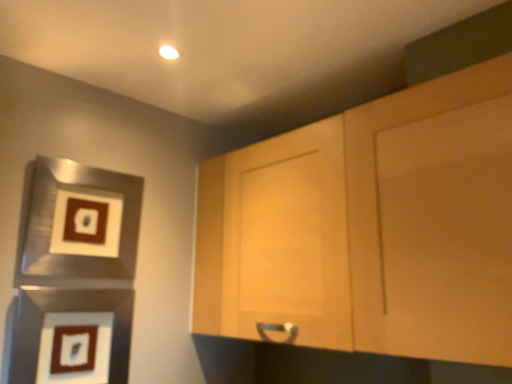
Question: Is matte black picture frame at lower left, positioned as the second picture frame in top-to-bottom order, thinner than light wood cabinet at upper right?

Choices:
 (A) yes
 (B) no

Answer: (A)

Question: Can you confirm if matte black picture frame at lower left, the 1th picture frame when ordered from bottom to top, is taller than light wood cabinet at upper right?

Choices:
 (A) no
 (B) yes

Answer: (A)

Question: Is matte black picture frame at lower left, the 1th picture frame when ordered from bottom to top, not close to light wood cabinet at upper right?

Choices:
 (A) no
 (B) yes

Answer: (A)

Question: From a real-world perspective, is matte black picture frame at lower left, positioned as the second picture frame in top-to-bottom order, below light wood cabinet at upper right?

Choices:
 (A) no
 (B) yes

Answer: (B)

Question: From the image's perspective, is matte black picture frame at lower left, positioned as the second picture frame in top-to-bottom order, above light wood cabinet at upper right?

Choices:
 (A) no
 (B) yes

Answer: (A)

Question: Is matte black picture frame at lower left, the 1th picture frame when ordered from bottom to top, bigger or smaller than brushed metal picture frame at left, the 2th picture frame when ordered from bottom to top?

Choices:
 (A) big
 (B) small

Answer: (B)

Question: Is matte black picture frame at lower left, the 1th picture frame when ordered from bottom to top, inside the boundaries of brushed metal picture frame at left, which appears as the 1th picture frame when viewed from the top, or outside?

Choices:
 (A) outside
 (B) inside

Answer: (A)

Question: In terms of height, does matte black picture frame at lower left, positioned as the second picture frame in top-to-bottom order, look taller or shorter compared to brushed metal picture frame at left, the 2th picture frame when ordered from bottom to top?

Choices:
 (A) short
 (B) tall

Answer: (A)

Question: From the image's perspective, is matte black picture frame at lower left, positioned as the second picture frame in top-to-bottom order, located above or below brushed metal picture frame at left, the 2th picture frame when ordered from bottom to top?

Choices:
 (A) below
 (B) above

Answer: (A)

Question: From a real-world perspective, is brushed metal picture frame at left, the 2th picture frame when ordered from bottom to top, positioned above or below matte black picture frame at lower left, the 1th picture frame when ordered from bottom to top?

Choices:
 (A) below
 (B) above

Answer: (B)

Question: Considering their positions, is brushed metal picture frame at left, which appears as the 1th picture frame when viewed from the top, located in front of or behind matte black picture frame at lower left, positioned as the second picture frame in top-to-bottom order?

Choices:
 (A) front
 (B) behind

Answer: (B)

Question: From the image's perspective, is brushed metal picture frame at left, which appears as the 1th picture frame when viewed from the top, located above or below matte black picture frame at lower left, the 1th picture frame when ordered from bottom to top?

Choices:
 (A) above
 (B) below

Answer: (A)

Question: Is brushed metal picture frame at left, the 2th picture frame when ordered from bottom to top, inside or outside of matte black picture frame at lower left, the 1th picture frame when ordered from bottom to top?

Choices:
 (A) inside
 (B) outside

Answer: (B)

Question: Choose the correct answer: Is matte black picture frame at lower left, the 1th picture frame when ordered from bottom to top, inside light wood cabinet at upper right or outside it?

Choices:
 (A) inside
 (B) outside

Answer: (B)

Question: Is matte black picture frame at lower left, the 1th picture frame when ordered from bottom to top, wider or thinner than light wood cabinet at upper right?

Choices:
 (A) thin
 (B) wide

Answer: (A)